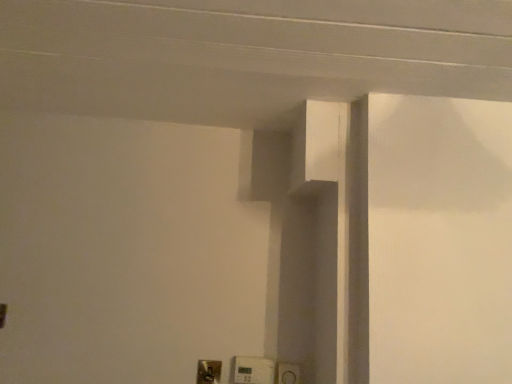
Question: Considering the positions of white plastic light switch at lower center, arranged as the second light switch when viewed from the right, and white plastic light switch at lower center, placed as the second light switch when sorted from left to right, in the image, is white plastic light switch at lower center, arranged as the second light switch when viewed from the right, wider or thinner than white plastic light switch at lower center, placed as the second light switch when sorted from left to right,?

Choices:
 (A) thin
 (B) wide

Answer: (A)

Question: Relative to white plastic light switch at lower center, which ranks as the first light switch in right-to-left order, is white plastic light switch at lower center, arranged as the second light switch when viewed from the right, in front or behind?

Choices:
 (A) front
 (B) behind

Answer: (B)

Question: Is point (220, 375) positioned closer to the camera than point (258, 374)?

Choices:
 (A) closer
 (B) farther

Answer: (A)

Question: Considering the positions of white plastic light switch at lower center, which ranks as the first light switch in right-to-left order, and white plastic light switch at lower center, arranged as the second light switch when viewed from the right, in the image, is white plastic light switch at lower center, which ranks as the first light switch in right-to-left order, wider or thinner than white plastic light switch at lower center, arranged as the second light switch when viewed from the right,?

Choices:
 (A) wide
 (B) thin

Answer: (A)

Question: Considering the relative positions of white plastic light switch at lower center, placed as the second light switch when sorted from left to right, and white plastic light switch at lower center, the 1th light switch from the left, in the image provided, is white plastic light switch at lower center, placed as the second light switch when sorted from left to right, to the left or to the right of white plastic light switch at lower center, the 1th light switch from the left,?

Choices:
 (A) left
 (B) right

Answer: (B)

Question: Choose the correct answer: Is white plastic light switch at lower center, which ranks as the first light switch in right-to-left order, inside white plastic light switch at lower center, arranged as the second light switch when viewed from the right, or outside it?

Choices:
 (A) outside
 (B) inside

Answer: (A)

Question: In terms of size, does white plastic light switch at lower center, placed as the second light switch when sorted from left to right, appear bigger or smaller than white plastic light switch at lower center, the 1th light switch from the left?

Choices:
 (A) big
 (B) small

Answer: (A)